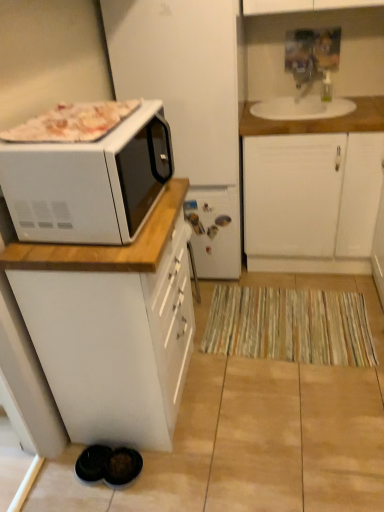
Question: From the image's perspective, is wooden countertop at upper right beneath white matte microwave at left?

Choices:
 (A) no
 (B) yes

Answer: (A)

Question: Is wooden countertop at upper right closer to the viewer compared to white matte microwave at left?

Choices:
 (A) yes
 (B) no

Answer: (B)

Question: Can you confirm if wooden countertop at upper right is taller than white matte microwave at left?

Choices:
 (A) yes
 (B) no

Answer: (B)

Question: From the image's perspective, is wooden countertop at upper right above white matte microwave at left?

Choices:
 (A) no
 (B) yes

Answer: (B)

Question: Is wooden countertop at upper right bigger than white matte microwave at left?

Choices:
 (A) no
 (B) yes

Answer: (A)

Question: Is wooden countertop at upper right directly adjacent to white matte microwave at left?

Choices:
 (A) yes
 (B) no

Answer: (B)

Question: Is white matte cabinet at upper right, the second cabinetry viewed from the left, placed right next to white matte microwave at left?

Choices:
 (A) yes
 (B) no

Answer: (B)

Question: Is the depth of white matte cabinet at upper right, the first cabinetry in the back-to-front sequence, less than that of white matte microwave at left?

Choices:
 (A) no
 (B) yes

Answer: (A)

Question: Is the position of white matte cabinet at upper right, the second cabinetry viewed from the left, more distant than that of white matte microwave at left?

Choices:
 (A) yes
 (B) no

Answer: (A)

Question: Does white matte cabinet at upper right, the second cabinetry from the front, appear on the left side of white matte microwave at left?

Choices:
 (A) no
 (B) yes

Answer: (A)

Question: Is white matte cabinet at upper right, the second cabinetry from the front, to the right of white matte microwave at left from the viewer's perspective?

Choices:
 (A) yes
 (B) no

Answer: (A)

Question: Does white matte cabinet at upper right, the second cabinetry viewed from the left, contain white matte microwave at left?

Choices:
 (A) no
 (B) yes

Answer: (A)

Question: Is white glossy microwave at upper left far away from wooden countertop at upper right?

Choices:
 (A) yes
 (B) no

Answer: (A)